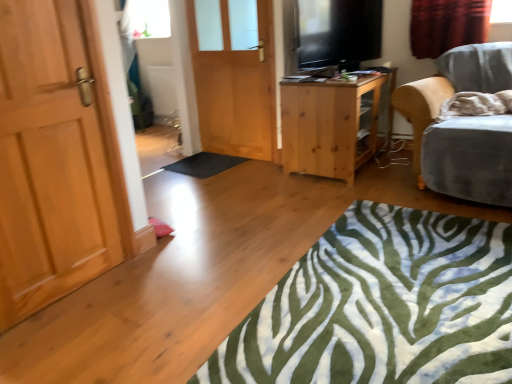
Locate an element on the screen. Image resolution: width=512 pixels, height=384 pixels. vacant space that is in between light brown wooden table at center and green zebra-patterned rug at lower center is located at coordinates (303, 217).